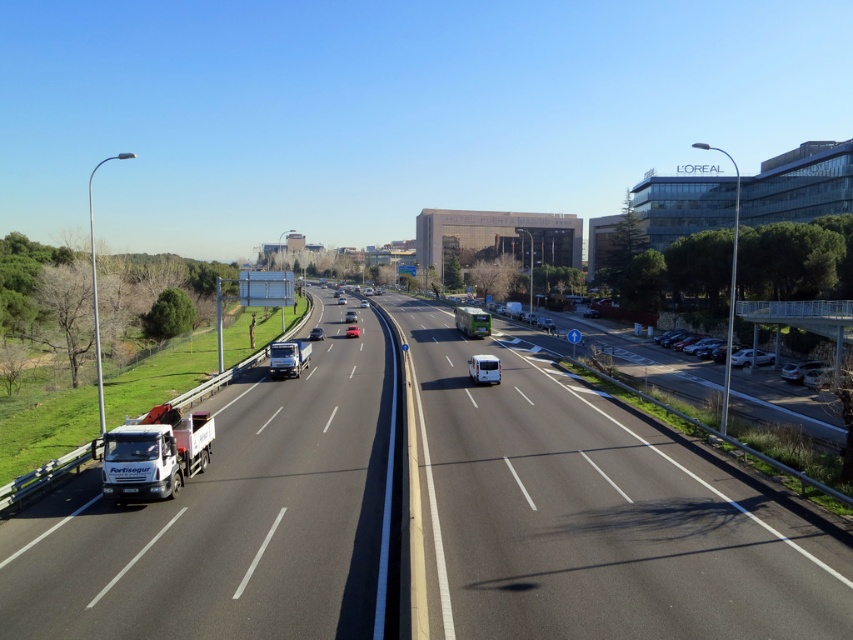
Question: Does satin silver sedan at right have a greater width compared to matte white van at center?

Choices:
 (A) yes
 (B) no

Answer: (A)

Question: Observing the image, what is the correct spatial positioning of silver metallic sedan at right in reference to matte white van at center?

Choices:
 (A) right
 (B) left

Answer: (A)

Question: Which of the following is the closest to the observer?

Choices:
 (A) coord(480,312)
 (B) coord(312,328)
 (C) coord(740,545)

Answer: (C)

Question: Does white matte truck at lower left appear under shiny silver sedan at center?

Choices:
 (A) no
 (B) yes

Answer: (B)

Question: Among these points, which one is nearest to the camera?

Choices:
 (A) (309, 355)
 (B) (314, 326)
 (C) (732, 358)

Answer: (A)

Question: Which object is the closest to the satin silver sedan at right?

Choices:
 (A) shiny silver sedan at center
 (B) shiny red sedan at center
 (C) white matte truck at lower left

Answer: (A)